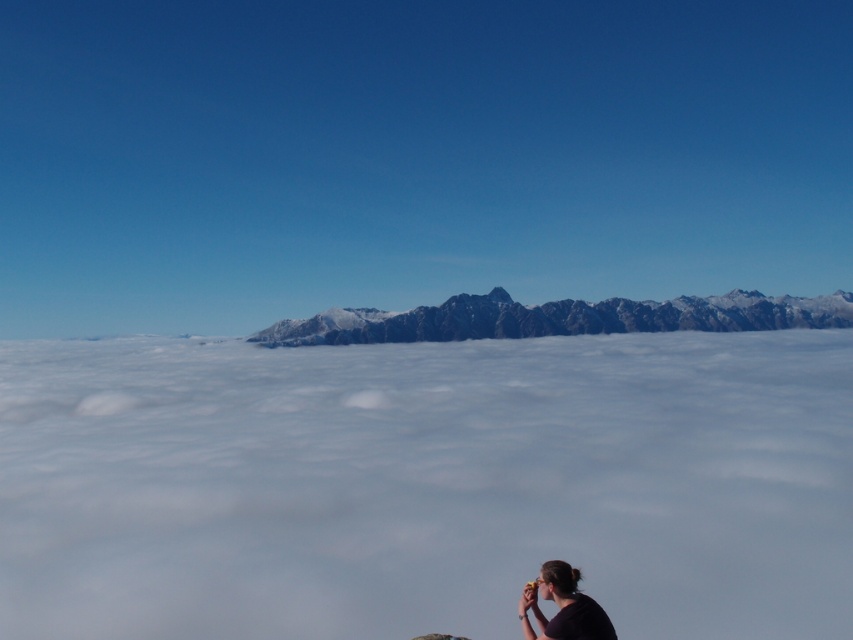
You are a photographer trying to capture the landscape. You notice the white fluffy cloud at center and the black matte shirt at lower right in your frame. Which object appears wider in the photo?

The white fluffy cloud at center appears wider in the photo because its width is larger than that of the black matte shirt at lower right.

You are a hiker who wants to take a photo of the snowy rocky mountains at center and the black matte shirt at lower right in the same frame. Given that your camera has a maximum zoom range of 1000 feet, can you capture both objects in a single photo without moving your position?

The distance between the snowy rocky mountains at center and the black matte shirt at lower right is 1441.17 feet, which exceeds the camera maximum zoom range of 1000 feet. Therefore, you cannot capture both objects in a single photo without moving your position.